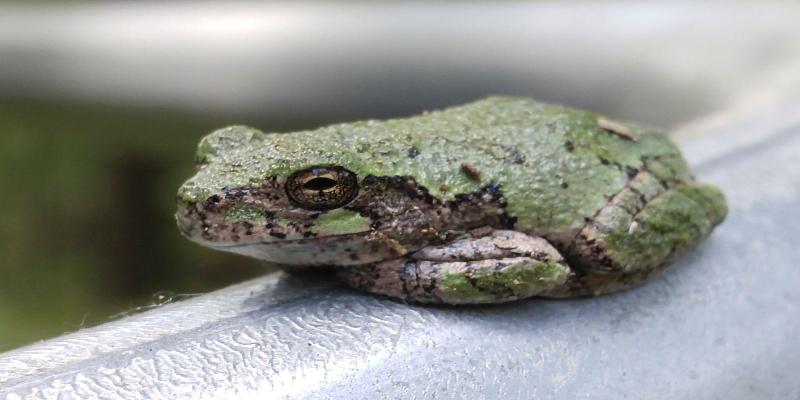
Where is `left front leg`? The width and height of the screenshot is (800, 400). left front leg is located at coordinates (458, 267).